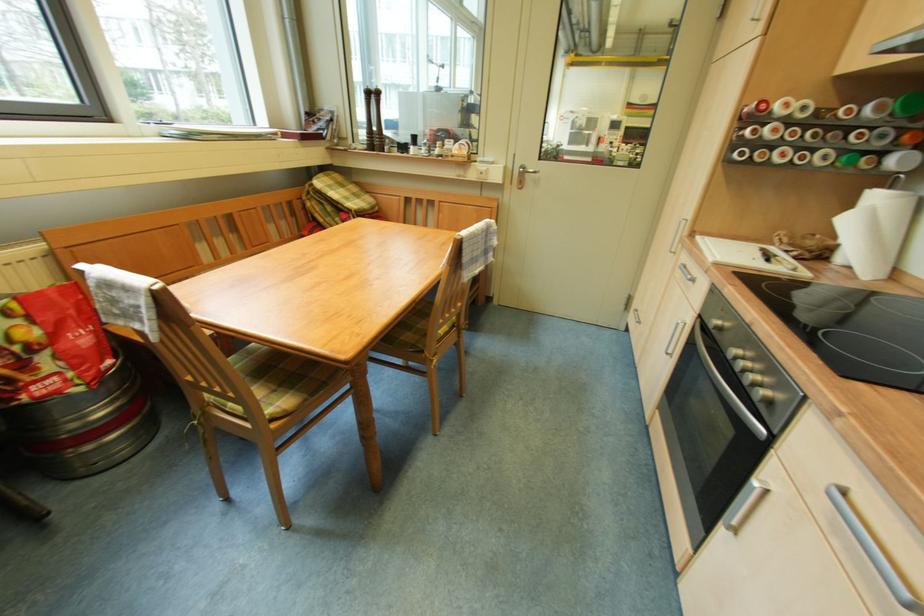
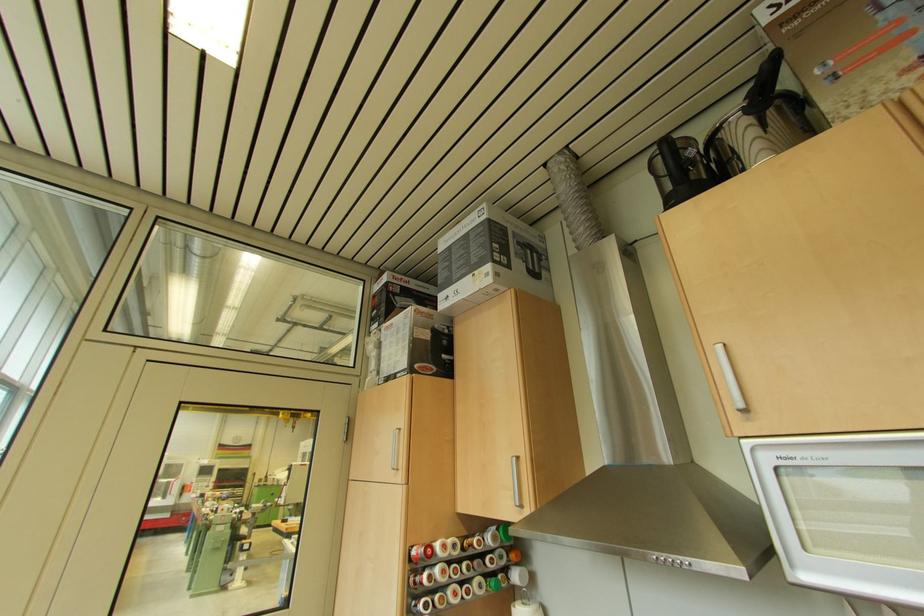
Where in the second image is the point corresponding to pixel 849 73 from the first image?

(468, 513)